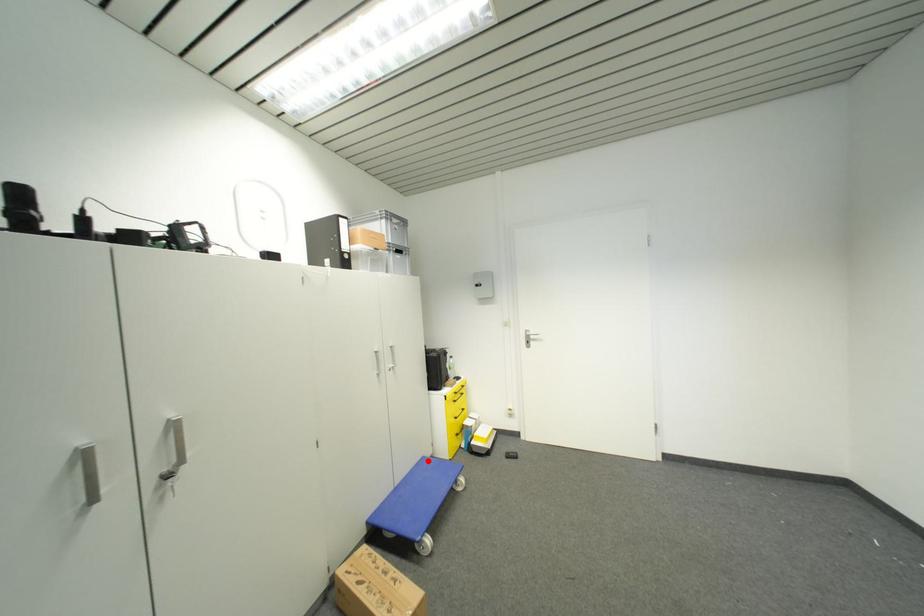
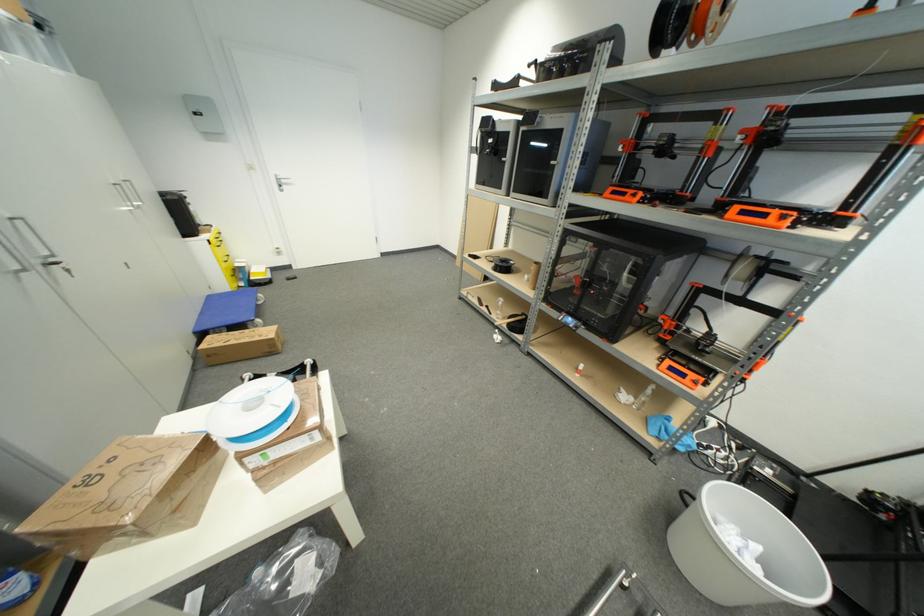
In the second image, find the point that corresponds to the highlighted location in the first image.

(213, 299)